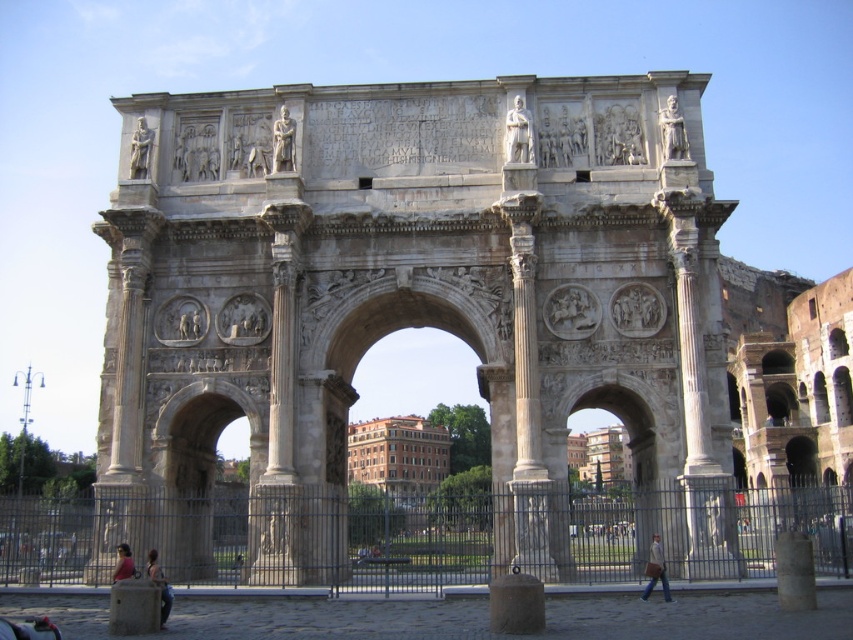
You are a tourist standing in front of the Arch of Constantine and see the stone archway at center and the light brown leather jacket at lower right. Which object is closer to your right side?

The light brown leather jacket at lower right is closer to your right side because the stone archway at center is positioned on the left side of it.

You are standing in front of the Arch of Constantine and notice a stone statue at center and a light brown leather jacket at lower center. Which object is located to the right of the other?

The stone statue at center is positioned on the right side of light brown leather jacket at lower center.